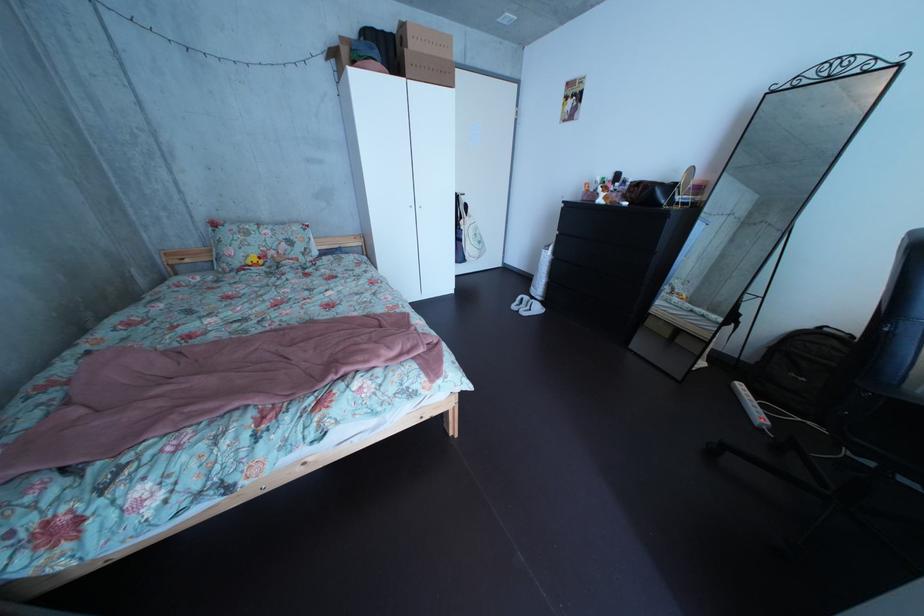
Where would you push the power strip switch? Please return your answer as a coordinate pair (x, y).

(749, 406)